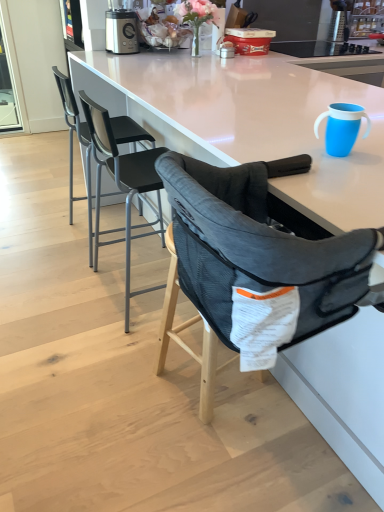
Where is `free space behind blue plastic cup at upper right`? free space behind blue plastic cup at upper right is located at coordinates (296, 125).